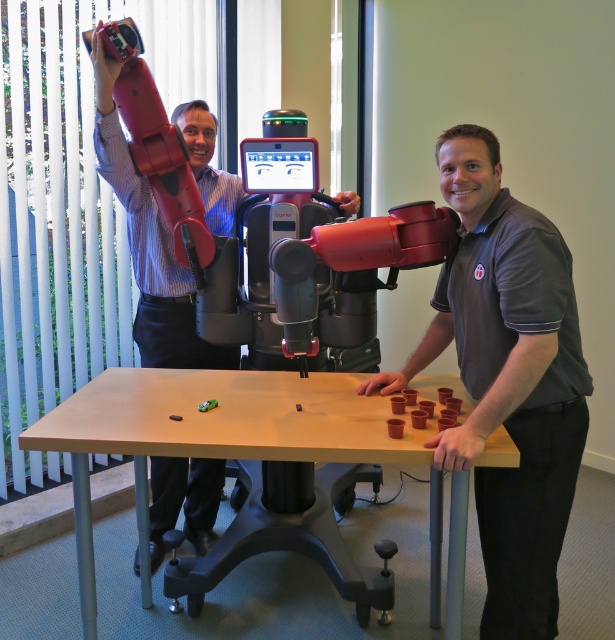
Is point (514, 509) positioned after point (105, 125)?

No, (514, 509) is in front of (105, 125).

Locate an element on the screen. gray smooth shirt at right is located at coordinates (507, 380).

At what (x,y) coordinates should I click in order to perform the action: click on gray smooth shirt at right. Please return your answer as a coordinate pair (x, y). Looking at the image, I should click on (507, 380).

Can you confirm if light brown wood table at center is positioned below brushed metal robot arm at upper left?

Correct, light brown wood table at center is located below brushed metal robot arm at upper left.

Does point (170, 381) lie behind point (170, 504)?

That is False.

Image resolution: width=615 pixels, height=640 pixels. I want to click on light brown wood table at center, so click(213, 429).

Is gray smooth shirt at right in front of light brown wood table at center?

Yes.

In the scene shown: Is gray smooth shirt at right smaller than light brown wood table at center?

Indeed, gray smooth shirt at right has a smaller size compared to light brown wood table at center.

Find the location of `gray smooth shirt at right`. gray smooth shirt at right is located at coordinates (507, 380).